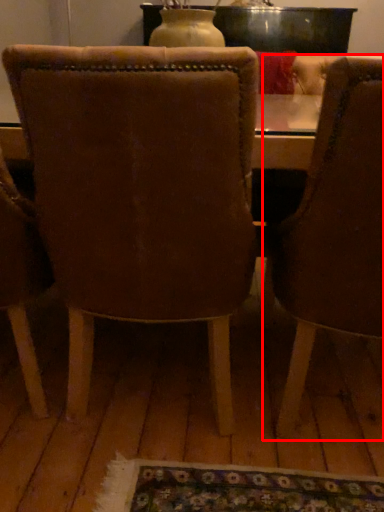
Question: Considering the relative positions of chair (annotated by the red box) and chair in the image provided, where is chair (annotated by the red box) located with respect to the staircase?

Choices:
 (A) right
 (B) left

Answer: (A)